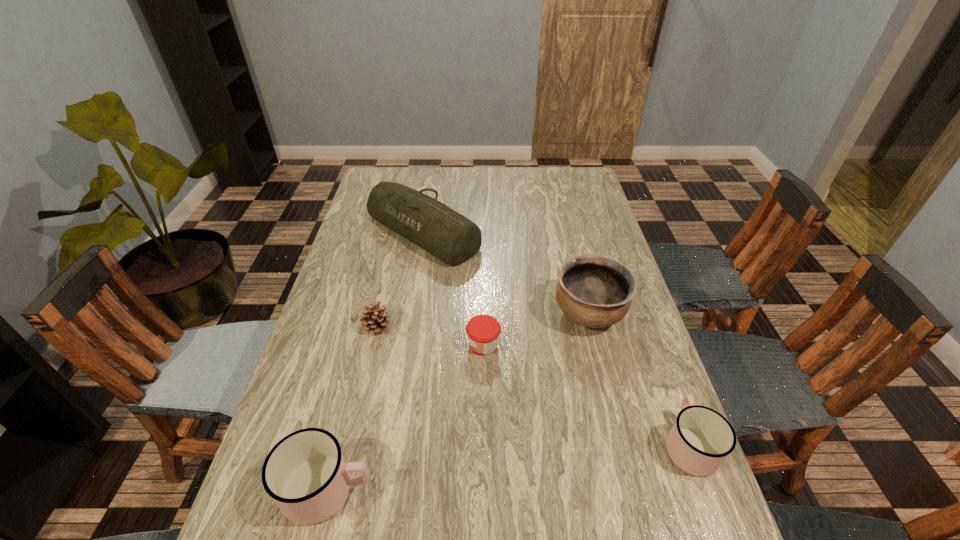
Where is `free space for an extra mug to achieve even spacing`? free space for an extra mug to achieve even spacing is located at coordinates (516, 466).